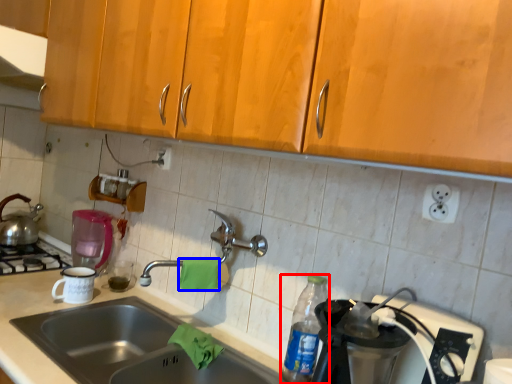
Question: Which object is further to the camera taking this photo, bottle (highlighted by a red box) or material (highlighted by a blue box)?

Choices:
 (A) bottle
 (B) material

Answer: (B)